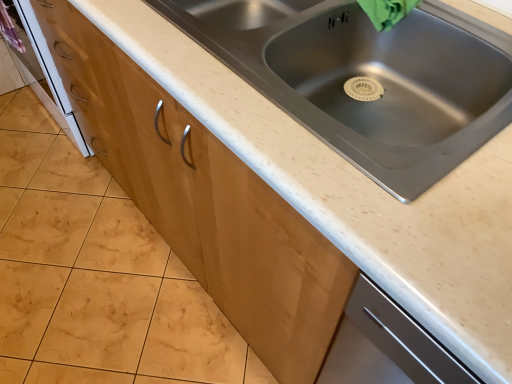
The image size is (512, 384). In order to click on vacant area that is in front of white glossy oven at lower left in this screenshot , I will do `click(50, 184)`.